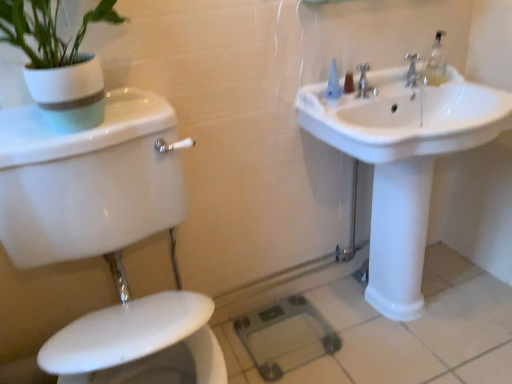
Question: Considering the relative sizes of white glossy toilet at lower left and metallic silver faucet at upper right, which is counted as the 1th tap, starting from the right, in the image provided, is white glossy toilet at lower left thinner than metallic silver faucet at upper right, which is counted as the 1th tap, starting from the right,?

Choices:
 (A) no
 (B) yes

Answer: (A)

Question: Is white glossy toilet at lower left at the right side of metallic silver faucet at upper right, which is counted as the 1th tap, starting from the right?

Choices:
 (A) no
 (B) yes

Answer: (A)

Question: From the image's perspective, is white glossy toilet at lower left below metallic silver faucet at upper right, which is counted as the 1th tap, starting from the right?

Choices:
 (A) no
 (B) yes

Answer: (B)

Question: Can you confirm if white glossy toilet at lower left is wider than metallic silver faucet at upper right, which is counted as the 1th tap, starting from the right?

Choices:
 (A) no
 (B) yes

Answer: (B)

Question: Considering the relative sizes of white glossy toilet at lower left and metallic silver faucet at upper right, which is counted as the 1th tap, starting from the right, in the image provided, is white glossy toilet at lower left bigger than metallic silver faucet at upper right, which is counted as the 1th tap, starting from the right,?

Choices:
 (A) no
 (B) yes

Answer: (B)

Question: Considering the positions of point (22, 44) and point (420, 54), is point (22, 44) closer or farther from the camera than point (420, 54)?

Choices:
 (A) closer
 (B) farther

Answer: (A)

Question: In terms of height, does white glossy pot at upper left look taller or shorter compared to metallic silver faucet at upper right, which is counted as the 1th tap, starting from the right?

Choices:
 (A) tall
 (B) short

Answer: (A)

Question: Looking at their shapes, would you say white glossy pot at upper left is wider or thinner than metallic silver faucet at upper right, which is counted as the 1th tap, starting from the right?

Choices:
 (A) wide
 (B) thin

Answer: (A)

Question: Would you say white glossy pot at upper left is to the left or to the right of metallic silver faucet at upper right, which is counted as the 1th tap, starting from the right, in the picture?

Choices:
 (A) right
 (B) left

Answer: (B)

Question: From a real-world perspective, is white glossy sink at upper right positioned above or below white glossy toilet at lower left?

Choices:
 (A) below
 (B) above

Answer: (A)

Question: In terms of height, does white glossy sink at upper right look taller or shorter compared to white glossy toilet at lower left?

Choices:
 (A) tall
 (B) short

Answer: (B)

Question: Considering their positions, is white glossy sink at upper right located in front of or behind white glossy toilet at lower left?

Choices:
 (A) behind
 (B) front

Answer: (A)

Question: Is white glossy sink at upper right to the left or to the right of white glossy toilet at lower left in the image?

Choices:
 (A) right
 (B) left

Answer: (A)

Question: Considering the relative positions of metallic silver faucet at upper right, which is counted as the 1th tap, starting from the right, and white glossy pot at upper left in the image provided, is metallic silver faucet at upper right, which is counted as the 1th tap, starting from the right, to the left or to the right of white glossy pot at upper left?

Choices:
 (A) left
 (B) right

Answer: (B)

Question: Is point (409, 86) positioned closer to the camera than point (83, 64)?

Choices:
 (A) farther
 (B) closer

Answer: (A)